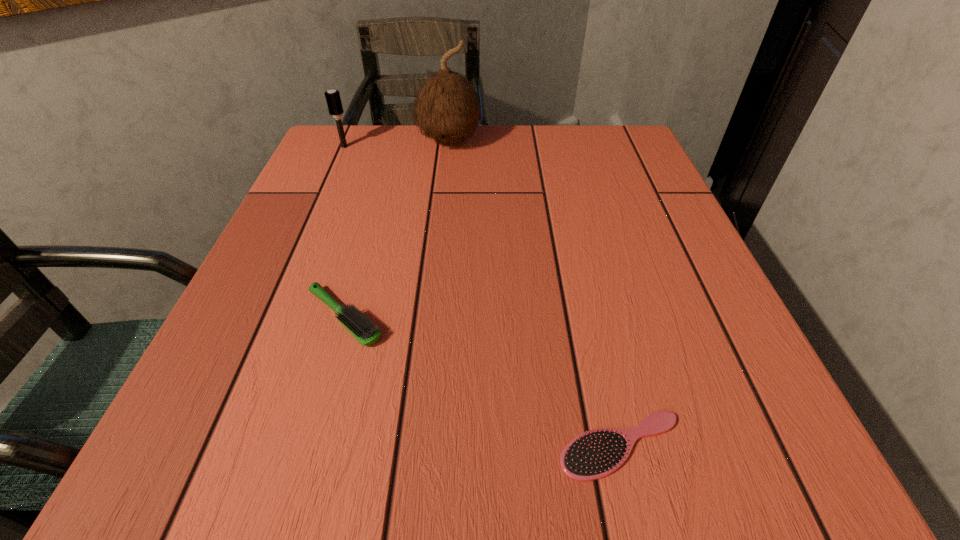
Where is `vacant area between the third farthest object and the tallest hairbrush`? The height and width of the screenshot is (540, 960). vacant area between the third farthest object and the tallest hairbrush is located at coordinates [x=345, y=232].

Image resolution: width=960 pixels, height=540 pixels. What are the coordinates of `vacant area between the coconut and the second hairbrush from right to left` in the screenshot? It's located at (396, 230).

Identify the location of empty space that is in between the leftmost object and the second nearest hairbrush. (345, 232).

You are a GUI agent. You are given a task and a screenshot of the screen. Output one action in this format:
    pyautogui.click(x=<x>, y=<y>)
    Task: Click on the vacant space in between the shortest object and the coconut
    This screenshot has height=540, width=960.
    Given the screenshot: What is the action you would take?
    pyautogui.click(x=535, y=293)

Locate which object is the third closest to the tallest object. Please provide its 2D coordinates. Your answer should be formatted as a tuple, i.e. [(x, y)], where the tuple contains the x and y coordinates of a point satisfying the conditions above.

[(593, 455)]

At what (x,y) coordinates should I click in order to perform the action: click on object that is the third nearest to the third shortest object. Please return your answer as a coordinate pair (x, y). Looking at the image, I should click on (593, 455).

Where is `hairbrush that is the closest one to the rightmost object`? The image size is (960, 540). hairbrush that is the closest one to the rightmost object is located at coordinates (366, 333).

This screenshot has width=960, height=540. I want to click on the second closest hairbrush to the tallest object, so click(366, 333).

Find the location of a particular element. This screenshot has height=540, width=960. free location that satisfies the following two spatial constraints: 1. on the front side of the leftmost object; 2. on the right side of the third farthest object is located at coordinates (270, 317).